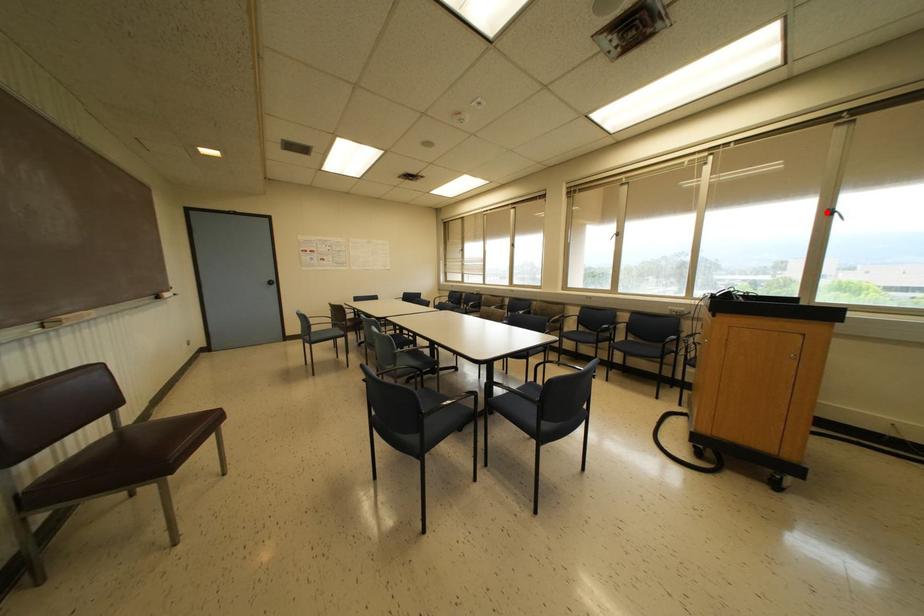
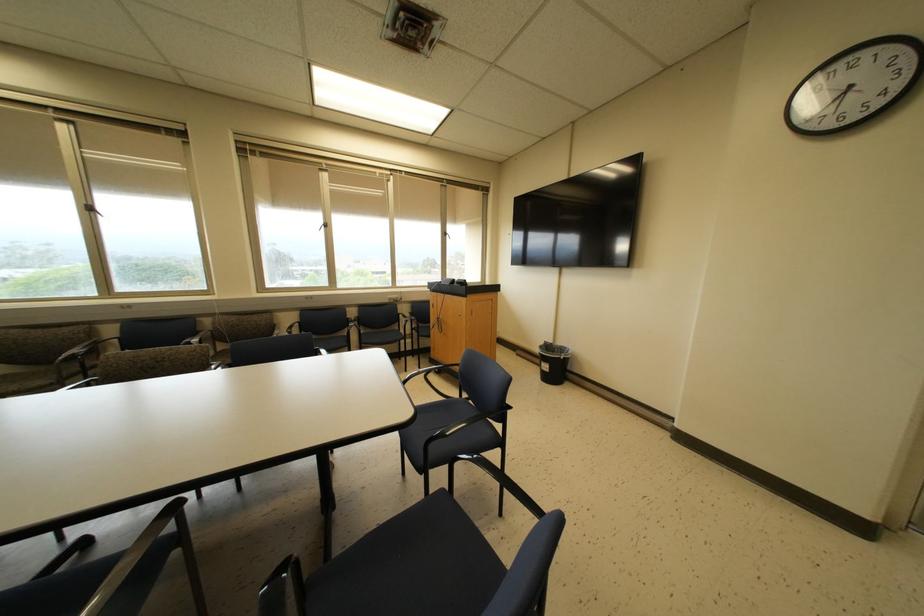
The point at the highlighted location is marked in the first image. Where is the corresponding point in the second image?

(444, 233)